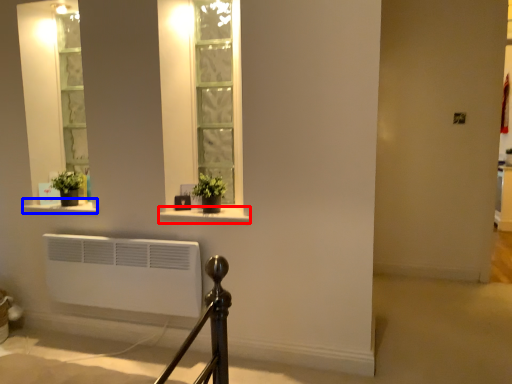
Question: Which of the following is the farthest to the observer, window sill (highlighted by a red box) or window sill (highlighted by a blue box)?

Choices:
 (A) window sill
 (B) window sill

Answer: (B)